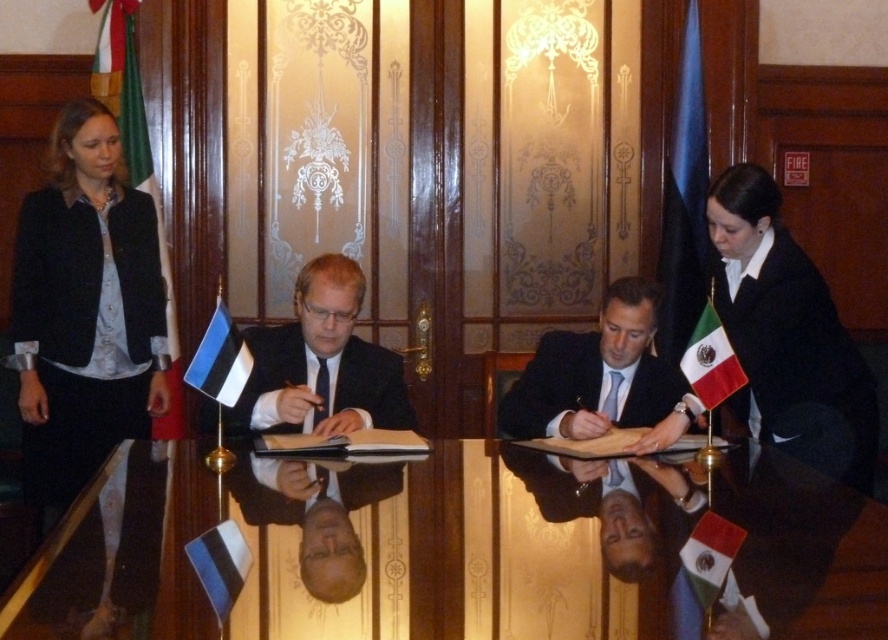
You are a photographer at the signing ceremony. You need to place a 1.2 meter wide backdrop behind the black glossy table at center and the whiteflag at left. Will the backdrop be wide enough to cover both objects?

The black glossy table at center is wider than the whiteflag at left. Since the backdrop is 1.2 meters wide, it should be sufficient to cover both objects as long as their combined width does not exceed the backdrop width. However, without exact measurements of the objects, we cannot confirm definitively.

You are standing in the room facing the signing ceremony. Where is the black fabric jacket at left located in terms of its position relative to the table?

The black fabric jacket at left is located at the position corresponding to the 2D coordinates point (85, 310) relative to the table.

You are attending a formal signing ceremony and need to place a document on the table. The document is as large as the whiteflag at left. Will it fit on the black glossy table at center?

The black glossy table at center is larger in size than the whiteflag at left, so the document will fit on the table.